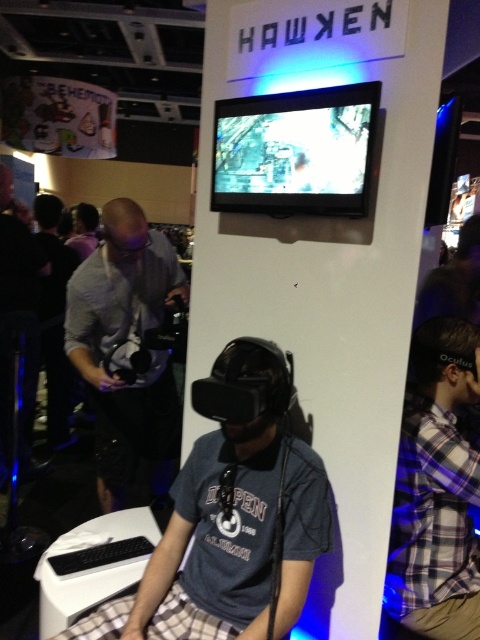
Can you confirm if plaid fabric shirt at right is positioned above gray fabric shirt at left?

No.

The height and width of the screenshot is (640, 480). Describe the element at coordinates (436, 490) in the screenshot. I see `plaid fabric shirt at right` at that location.

Is point (452, 449) less distant than point (152, 372)?

That is True.

The height and width of the screenshot is (640, 480). I want to click on plaid fabric shirt at right, so click(436, 490).

Can you confirm if matte gray vr headset at center is thinner than gray fabric shirt at left?

In fact, matte gray vr headset at center might be wider than gray fabric shirt at left.

Image resolution: width=480 pixels, height=640 pixels. I want to click on matte gray vr headset at center, so pos(231,516).

Can you confirm if matte gray vr headset at center is smaller than plaid fabric shirt at right?

No.

Between point (279, 364) and point (476, 390), which one is positioned in front?

Point (279, 364) is in front.

Is point (201, 547) positioned in front of point (436, 317)?

That is True.

I want to click on matte gray vr headset at center, so click(231, 516).